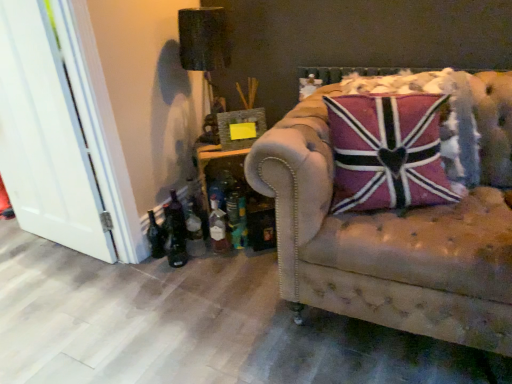
Find the location of a particular element. free space in front of translucent glass bottle at lower left, the 1th bottle viewed from the right is located at coordinates (222, 265).